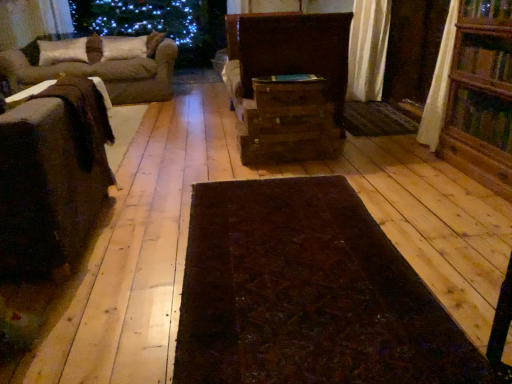
Question: Can you confirm if suede-like beige pillow at upper left, the second pillow when ordered from right to left, is taller than wooden trunk at center, which appears as the first furniture when viewed from the right?

Choices:
 (A) no
 (B) yes

Answer: (A)

Question: Is wooden trunk at center, which is the 1th furniture from back to front, a part of suede-like beige pillow at upper left, the 1th pillow viewed from the left?

Choices:
 (A) no
 (B) yes

Answer: (A)

Question: Can you confirm if suede-like beige pillow at upper left, the second pillow when ordered from right to left, is bigger than wooden trunk at center, the second furniture positioned from the left?

Choices:
 (A) no
 (B) yes

Answer: (A)

Question: Is suede-like beige pillow at upper left, the second pillow when ordered from right to left, positioned far away from wooden trunk at center, the second furniture positioned from the left?

Choices:
 (A) no
 (B) yes

Answer: (B)

Question: From the image's perspective, is suede-like beige pillow at upper left, the second pillow when ordered from right to left, below wooden trunk at center, the second furniture when ordered from front to back?

Choices:
 (A) yes
 (B) no

Answer: (B)

Question: Is suede-like beige pillow at upper left, the 1th pillow viewed from the left, positioned beyond the bounds of wooden trunk at center, the second furniture positioned from the left?

Choices:
 (A) no
 (B) yes

Answer: (B)

Question: From the image's perspective, would you say brown wooden drawer at center, the first drawer positioned from the bottom, is shown under dark brown textured mat at center, which ranks as the 1th mat in left-to-right order?

Choices:
 (A) no
 (B) yes

Answer: (A)

Question: Is brown wooden drawer at center, which is counted as the 3th drawer, starting from the top, far from dark brown textured mat at center, the 1th mat from the bottom?

Choices:
 (A) no
 (B) yes

Answer: (B)

Question: Does brown wooden drawer at center, which is counted as the 3th drawer, starting from the top, have a smaller size compared to dark brown textured mat at center, the first mat positioned from the front?

Choices:
 (A) no
 (B) yes

Answer: (A)

Question: Can you confirm if brown wooden drawer at center, which is counted as the 3th drawer, starting from the top, is thinner than dark brown textured mat at center, acting as the second mat starting from the top?

Choices:
 (A) no
 (B) yes

Answer: (B)

Question: Does brown wooden drawer at center, the first drawer positioned from the bottom, have a lesser height compared to dark brown textured mat at center, which ranks as the 1th mat in left-to-right order?

Choices:
 (A) no
 (B) yes

Answer: (A)

Question: Does brown wooden drawer at center, which is counted as the 3th drawer, starting from the top, appear on the right side of dark brown textured mat at center, the 1th mat from the bottom?

Choices:
 (A) yes
 (B) no

Answer: (A)

Question: From a real-world perspective, is wooden table at left physically below wooden chest at center, placed as the first drawer when sorted from top to bottom?

Choices:
 (A) yes
 (B) no

Answer: (B)